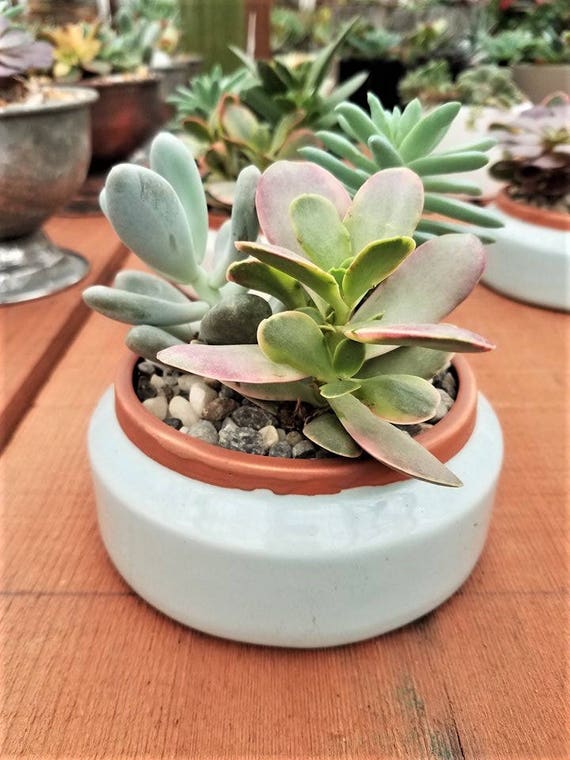
Find the location of a particular element. rounded plant is located at coordinates (197, 279), (399, 299), (342, 361).